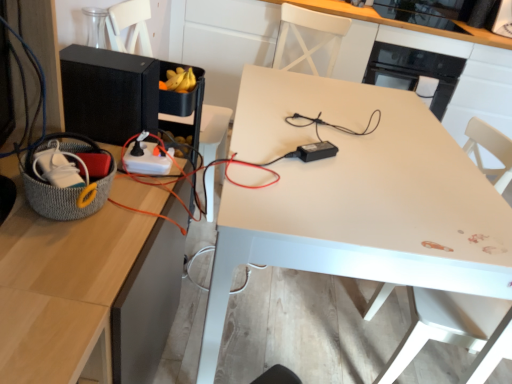
How much space does black plastic power adapter at center, marked as the third appliance in a top-to-bottom arrangement, occupy vertically?

It is 1.71 inches.

What do you see at coordinates (316, 151) in the screenshot?
I see `black plastic power adapter at center, the second appliance positioned from the right` at bounding box center [316, 151].

What do you see at coordinates (414, 71) in the screenshot? Image resolution: width=512 pixels, height=384 pixels. I see `black glossy microwave at upper right, the 1th appliance when ordered from right to left` at bounding box center [414, 71].

What is the approximate width of black glossy microwave at upper right, the 3th appliance when ordered from front to back?

24.92 inches.

Measure the distance between point (143, 159) and camera.

Point (143, 159) and camera are 3.89 feet apart.

What are the coordinates of `black plastic power adapter at center, positioned as the second appliance in left-to-right order` in the screenshot? It's located at pyautogui.click(x=316, y=151).

From a real-world perspective, is black matte speaker at left, the 2th appliance in the bottom-to-top sequence, physically located above or below knitted gray basket at left?

black matte speaker at left, the 2th appliance in the bottom-to-top sequence, is situated higher than knitted gray basket at left in the real world.

You are a GUI agent. You are given a task and a screenshot of the screen. Output one action in this format:
    pyautogui.click(x=<x>, y=<y>)
    Task: Click on the appliance lying on the left of knitted gray basket at left
    
    Given the screenshot: What is the action you would take?
    pyautogui.click(x=109, y=93)

Is black matte speaker at left, placed as the 2th appliance when sorted from back to front, shorter than knitted gray basket at left?

Incorrect, the height of black matte speaker at left, placed as the 2th appliance when sorted from back to front, does not fall short of that of knitted gray basket at left.

Is black matte speaker at left, the 1th appliance from the left, at the right side of knitted gray basket at left?

No.

Is black plastic power adapter at center, which ranks as the first appliance in bottom-to-top order, aimed at black matte speaker at left, the 2th appliance in the bottom-to-top sequence?

No, black plastic power adapter at center, which ranks as the first appliance in bottom-to-top order, is not oriented towards black matte speaker at left, the 2th appliance in the bottom-to-top sequence.

Could you measure the distance between black plastic power adapter at center, positioned as the second appliance in left-to-right order, and black matte speaker at left, the 1th appliance from the left?

22.65 inches.

From the image's perspective, which is above, black plastic power adapter at center, the second appliance positioned from the right, or black matte speaker at left, the 2th appliance in the bottom-to-top sequence?

black matte speaker at left, the 2th appliance in the bottom-to-top sequence, from the image's perspective.

Does black plastic power adapter at center, positioned as the second appliance in left-to-right order, have a greater height compared to black matte speaker at left, placed as the 2th appliance when sorted from back to front?

Incorrect, the height of black plastic power adapter at center, positioned as the second appliance in left-to-right order, is not larger of that of black matte speaker at left, placed as the 2th appliance when sorted from back to front.

Are white plastic swivel chair at center and black matte speaker at left, placed as the 2th appliance when sorted from back to front, making contact?

white plastic swivel chair at center and black matte speaker at left, placed as the 2th appliance when sorted from back to front, are not in contact.

Which is farther, (473, 309) or (69, 48)?

The point (473, 309) is farther.

In the image, is white plastic swivel chair at center positioned in front of or behind black matte speaker at left, the 2th appliance viewed from the top?

In the image, white plastic swivel chair at center appears in front of black matte speaker at left, the 2th appliance viewed from the top.

Which object is positioned more to the right, white plastic swivel chair at center or black matte speaker at left, placed as the 2th appliance when sorted from back to front?

white plastic swivel chair at center.

How different are the orientations of white plastic extension cord at lower left and black plastic power adapter at center, which ranks as the first appliance in bottom-to-top order, in degrees?

There is a 36.7-degree angle between the facing directions of white plastic extension cord at lower left and black plastic power adapter at center, which ranks as the first appliance in bottom-to-top order.

From a real-world perspective, count 2nd appliances upward from the white plastic extension cord at lower left and point to it. Please provide its 2D coordinates.

[(316, 151)]

Is white plastic extension cord at lower left not within black plastic power adapter at center, the 3th appliance in the back-to-front sequence?

Indeed, white plastic extension cord at lower left is completely outside black plastic power adapter at center, the 3th appliance in the back-to-front sequence.

Could you measure the distance between white plastic extension cord at lower left and black plastic power adapter at center, the second appliance positioned from the right?

A distance of 16.87 inches exists between white plastic extension cord at lower left and black plastic power adapter at center, the second appliance positioned from the right.

Which of these two, knitted gray basket at left or black matte speaker at left, arranged as the third appliance when viewed from the right, is smaller?

knitted gray basket at left.

Which object is more forward, knitted gray basket at left or black matte speaker at left, placed as the 2th appliance when sorted from front to back?

knitted gray basket at left is in front.

Which point is more forward, (x=62, y=218) or (x=119, y=71)?

The point (x=62, y=218) is more forward.

Between knitted gray basket at left and black matte speaker at left, placed as the 2th appliance when sorted from back to front, which one has larger width?

black matte speaker at left, placed as the 2th appliance when sorted from back to front, is wider.

From the image's perspective, is knitted gray basket at left on top of black plastic power adapter at center, the second appliance positioned from the right?

No, from the image's perspective, knitted gray basket at left is not above black plastic power adapter at center, the second appliance positioned from the right.

Which of these two, knitted gray basket at left or black plastic power adapter at center, the 3th appliance in the back-to-front sequence, stands taller?

With more height is knitted gray basket at left.

Considering the positions of objects knitted gray basket at left and black plastic power adapter at center, the 3th appliance in the back-to-front sequence, in the image provided, who is more to the left, knitted gray basket at left or black plastic power adapter at center, the 3th appliance in the back-to-front sequence,?

From the viewer's perspective, knitted gray basket at left appears more on the left side.

Could you tell me if black plastic power adapter at center, which ranks as the first appliance in bottom-to-top order, is turned towards knitted gray basket at left?

No, black plastic power adapter at center, which ranks as the first appliance in bottom-to-top order, is not oriented towards knitted gray basket at left.

Between black plastic power adapter at center, the second appliance positioned from the right, and knitted gray basket at left, which one has more height?

knitted gray basket at left is taller.

Find the location of a particular element. The image size is (512, 384). the 1st appliance behind the knitted gray basket at left is located at coordinates (316, 151).

Considering the positions of point (307, 145) and point (57, 220), is point (307, 145) closer or farther from the camera than point (57, 220)?

Clearly, point (307, 145) is more distant from the camera than point (57, 220).

I want to click on basket in front of the black matte speaker at left, the 2th appliance in the bottom-to-top sequence, so click(x=62, y=195).

Locate an element on the screen. The height and width of the screenshot is (384, 512). appliance that is below the black matte speaker at left, the 1th appliance from the left (from the image's perspective) is located at coordinates (316, 151).

Based on their spatial positions, is white plastic swivel chair at center or black matte speaker at left, placed as the 2th appliance when sorted from back to front, further from black glossy microwave at upper right, which ranks as the first appliance in top-to-bottom order?

The object further to black glossy microwave at upper right, which ranks as the first appliance in top-to-bottom order, is black matte speaker at left, placed as the 2th appliance when sorted from back to front.

Estimate the real-world distances between objects in this image. Which object is closer to white plastic extension cord at lower left, knitted gray basket at left or black glossy microwave at upper right, the 1th appliance when ordered from right to left?

The object closer to white plastic extension cord at lower left is knitted gray basket at left.

When comparing their distances from black matte speaker at left, the 1th appliance from the left, does black glossy microwave at upper right, the 1th appliance when ordered from right to left, or white plastic swivel chair at center seem further?

Among the two, black glossy microwave at upper right, the 1th appliance when ordered from right to left, is located further to black matte speaker at left, the 1th appliance from the left.

From the image, which object appears to be farther from white glossy table at center, white plastic swivel chair at center or knitted gray basket at left?

knitted gray basket at left.

From the picture: From the image, which object appears to be nearer to white plastic extension cord at lower left, black plastic power adapter at center, which appears as the first appliance when viewed from the front, or white glossy table at center?

The object closer to white plastic extension cord at lower left is black plastic power adapter at center, which appears as the first appliance when viewed from the front.

Considering their positions, is white plastic swivel chair at center positioned closer to white glossy table at center than black glossy microwave at upper right, which ranks as the first appliance in top-to-bottom order?

Among the two, white plastic swivel chair at center is located nearer to white glossy table at center.

Considering their positions, is black plastic power adapter at center, marked as the third appliance in a top-to-bottom arrangement, positioned further to black matte speaker at left, the 2th appliance viewed from the top, than white plastic extension cord at lower left?

black plastic power adapter at center, marked as the third appliance in a top-to-bottom arrangement, lies further to black matte speaker at left, the 2th appliance viewed from the top, than the other object.

When comparing their distances from knitted gray basket at left, does white plastic swivel chair at center or white plastic extension cord at lower left seem further?

white plastic swivel chair at center.

This screenshot has height=384, width=512. What are the coordinates of `appliance between knitted gray basket at left and white plastic swivel chair at center` in the screenshot? It's located at (316, 151).

The image size is (512, 384). Identify the location of extension cord between knitted gray basket at left and white glossy table at center in the horizontal direction. pyautogui.click(x=146, y=160).

Identify the location of appliance located between black matte speaker at left, the 2th appliance in the bottom-to-top sequence, and white glossy table at center in the left-right direction. (316, 151).

Find the location of a particular element. appliance between white plastic extension cord at lower left and white glossy table at center from left to right is located at coordinates (316, 151).